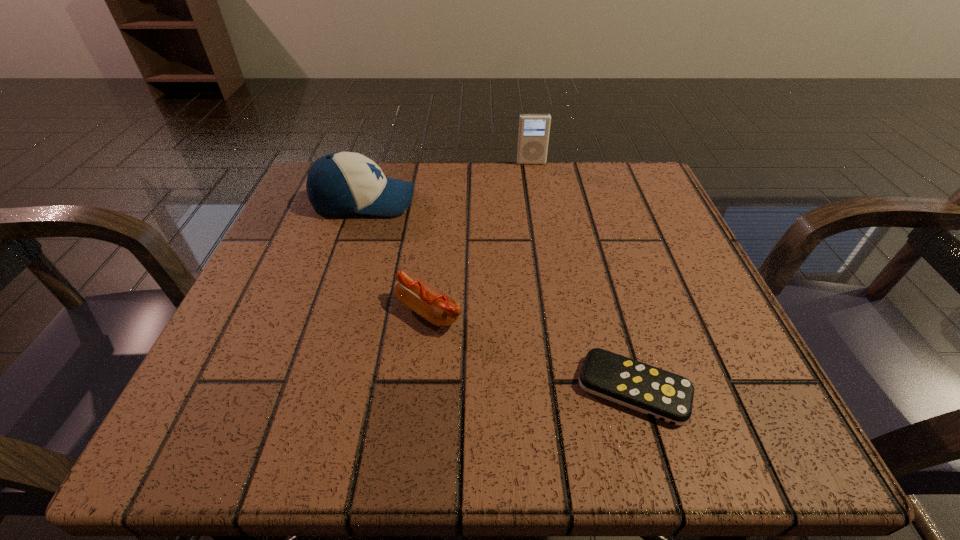
Identify the location of free point between the second nearest object and the remote control. Image resolution: width=960 pixels, height=540 pixels. (531, 350).

Locate an element on the screen. empty location between the baseball cap and the sausage is located at coordinates (396, 256).

What are the coordinates of `blank region between the second nearest object and the second farthest object` in the screenshot? It's located at (396, 256).

At what (x,y) coordinates should I click in order to perform the action: click on object that ranks as the second closest to the baseball cap. Please return your answer as a coordinate pair (x, y). This screenshot has height=540, width=960. Looking at the image, I should click on (533, 136).

Identify the location of object that is the second closest to the second shortest object. Image resolution: width=960 pixels, height=540 pixels. (340, 183).

Where is `vacant region that satisfies the following two spatial constraints: 1. on the front-facing side of the farthest object; 2. on the front-facing side of the third nearest object`? Image resolution: width=960 pixels, height=540 pixels. vacant region that satisfies the following two spatial constraints: 1. on the front-facing side of the farthest object; 2. on the front-facing side of the third nearest object is located at coordinates (538, 202).

Locate an element on the screen. This screenshot has height=540, width=960. free space that satisfies the following two spatial constraints: 1. on the front-facing side of the third tallest object; 2. on the left side of the third nearest object is located at coordinates (328, 311).

Where is `free space that satisfies the following two spatial constraints: 1. on the front-facing side of the second farthest object; 2. on the back side of the shortest object`? Image resolution: width=960 pixels, height=540 pixels. free space that satisfies the following two spatial constraints: 1. on the front-facing side of the second farthest object; 2. on the back side of the shortest object is located at coordinates (303, 389).

You are a GUI agent. You are given a task and a screenshot of the screen. Output one action in this format:
    pyautogui.click(x=<x>, y=<y>)
    Task: Click on the free location that satisfies the following two spatial constraints: 1. on the front-facing side of the second shortest object; 2. on the left side of the baseball cap
    
    Given the screenshot: What is the action you would take?
    pyautogui.click(x=328, y=311)

You are a GUI agent. You are given a task and a screenshot of the screen. Output one action in this format:
    pyautogui.click(x=<x>, y=<y>)
    Task: Click on the free point that satisfies the following two spatial constraints: 1. on the front-facing side of the iPod; 2. on the left side of the nearest object
    The height and width of the screenshot is (540, 960).
    Given the screenshot: What is the action you would take?
    pyautogui.click(x=568, y=389)